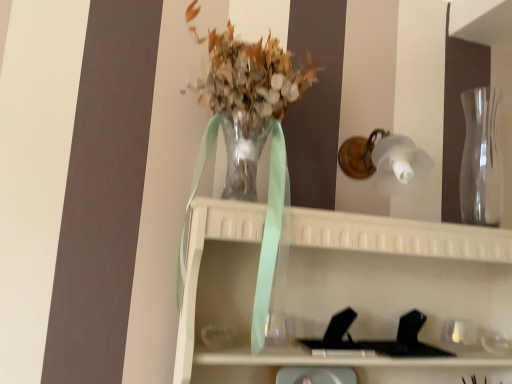
Question: Considering the relative positions of clear glass vase at right and translucent glass vase at center in the image provided, is clear glass vase at right to the left of translucent glass vase at center from the viewer's perspective?

Choices:
 (A) yes
 (B) no

Answer: (B)

Question: Considering the relative sizes of clear glass vase at right and translucent glass vase at center in the image provided, is clear glass vase at right bigger than translucent glass vase at center?

Choices:
 (A) no
 (B) yes

Answer: (A)

Question: Does clear glass vase at right have a greater width compared to translucent glass vase at center?

Choices:
 (A) yes
 (B) no

Answer: (B)

Question: Is clear glass vase at right taller than translucent glass vase at center?

Choices:
 (A) yes
 (B) no

Answer: (B)

Question: From the image's perspective, would you say clear glass vase at right is positioned over translucent glass vase at center?

Choices:
 (A) yes
 (B) no

Answer: (A)

Question: From the image's perspective, does clear glass vase at right appear lower than translucent glass vase at center?

Choices:
 (A) yes
 (B) no

Answer: (B)

Question: From the image's perspective, is translucent glass vase at center located above clear glass vase at right?

Choices:
 (A) no
 (B) yes

Answer: (A)

Question: Is translucent glass vase at center far away from clear glass vase at right?

Choices:
 (A) yes
 (B) no

Answer: (B)

Question: Is translucent glass vase at center looking in the opposite direction of clear glass vase at right?

Choices:
 (A) no
 (B) yes

Answer: (A)

Question: Considering the relative positions of translucent glass vase at center and clear glass vase at right in the image provided, is translucent glass vase at center to the left of clear glass vase at right from the viewer's perspective?

Choices:
 (A) no
 (B) yes

Answer: (B)

Question: Is translucent glass vase at center closer to the viewer compared to clear glass vase at right?

Choices:
 (A) yes
 (B) no

Answer: (A)

Question: Can you confirm if translucent glass vase at center is shorter than clear glass vase at right?

Choices:
 (A) no
 (B) yes

Answer: (A)

Question: In the image, is translucent glass vase at center on the left side or the right side of clear glass vase at right?

Choices:
 (A) right
 (B) left

Answer: (B)